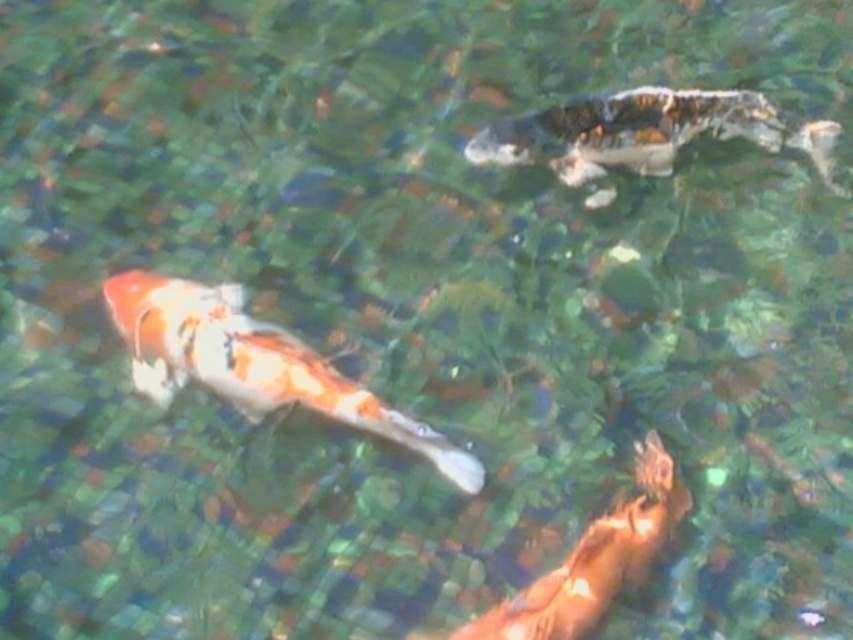
Question: Is orange and white scaled fish at center below orange and white scaled fish at bottom right?

Choices:
 (A) yes
 (B) no

Answer: (B)

Question: Which point appears closest to the camera in this image?

Choices:
 (A) (561, 147)
 (B) (219, 326)
 (C) (492, 627)

Answer: (C)

Question: Which point appears closest to the camera in this image?

Choices:
 (A) (614, 566)
 (B) (579, 154)
 (C) (146, 321)

Answer: (A)

Question: Which of the following is the closest to the observer?

Choices:
 (A) (671, 138)
 (B) (242, 317)
 (C) (496, 634)

Answer: (C)

Question: Is speckled white fish at upper right further to camera compared to orange and white scaled fish at bottom right?

Choices:
 (A) yes
 (B) no

Answer: (A)

Question: Is orange and white scaled fish at center positioned at the back of orange and white scaled fish at bottom right?

Choices:
 (A) no
 (B) yes

Answer: (B)